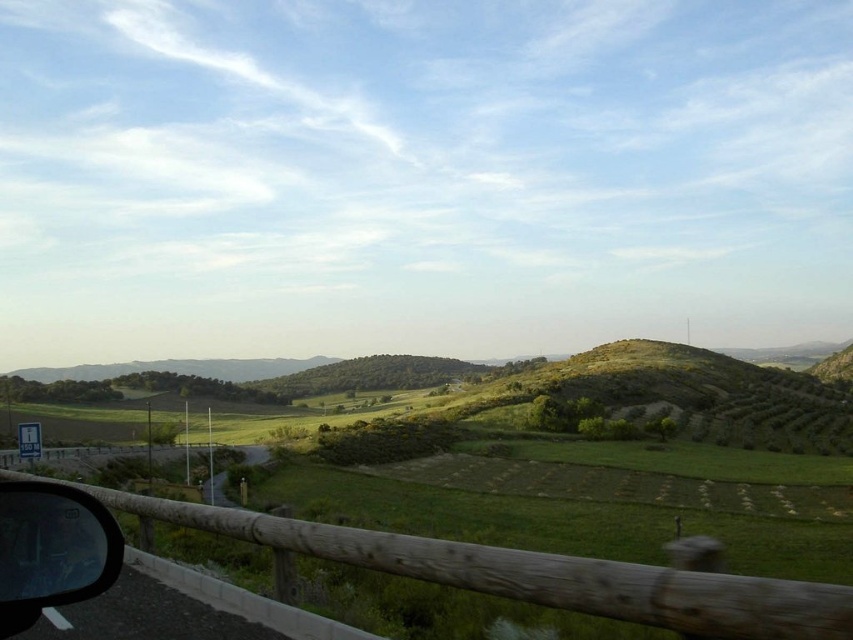
Question: Is wooden at lower center positioned at the back of transparent glass car window at lower left?

Choices:
 (A) no
 (B) yes

Answer: (B)

Question: Among these points, which one is nearest to the camera?

Choices:
 (A) (602, 570)
 (B) (77, 536)

Answer: (B)

Question: Is wooden at lower center bigger than transparent glass car window at lower left?

Choices:
 (A) yes
 (B) no

Answer: (A)

Question: Which point is farther to the camera?

Choices:
 (A) (791, 634)
 (B) (82, 544)

Answer: (B)

Question: Which point is farther to the camera?

Choices:
 (A) (738, 621)
 (B) (76, 566)

Answer: (A)

Question: Does wooden at lower center have a larger size compared to transparent glass car window at lower left?

Choices:
 (A) yes
 (B) no

Answer: (A)